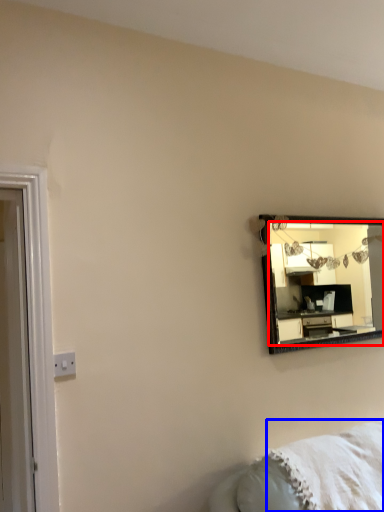
Question: Which object is further to the camera taking this photo, mirror (highlighted by a red box) or blanket (highlighted by a blue box)?

Choices:
 (A) mirror
 (B) blanket

Answer: (A)